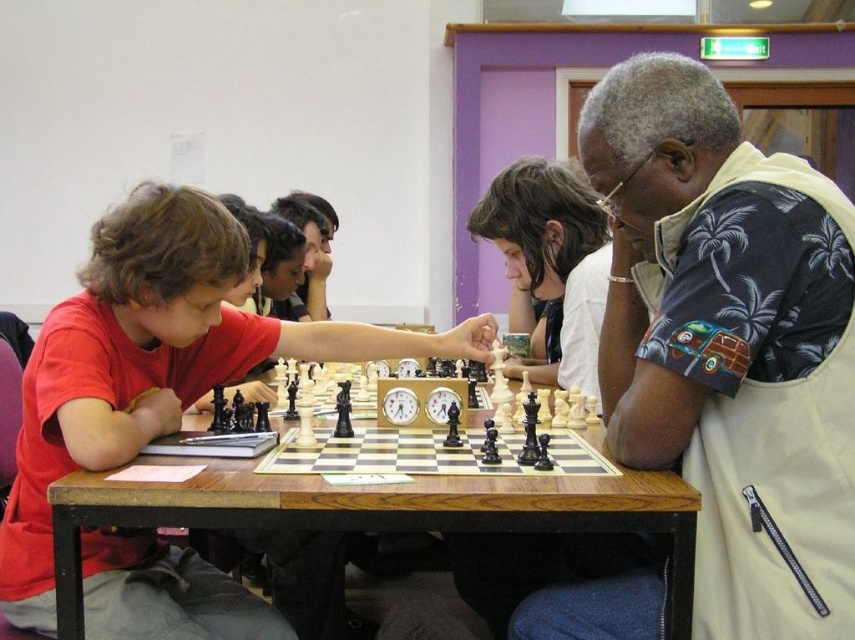
Is point (684, 436) farther from camera compared to point (193, 257)?

No.

Does black floral shirt at right have a lesser height compared to matte black chess set at center?

No.

You are a GUI agent. You are given a task and a screenshot of the screen. Output one action in this format:
    pyautogui.click(x=<x>, y=<y>)
    Task: Click on the black floral shirt at right
    The height and width of the screenshot is (640, 855).
    Given the screenshot: What is the action you would take?
    click(729, 344)